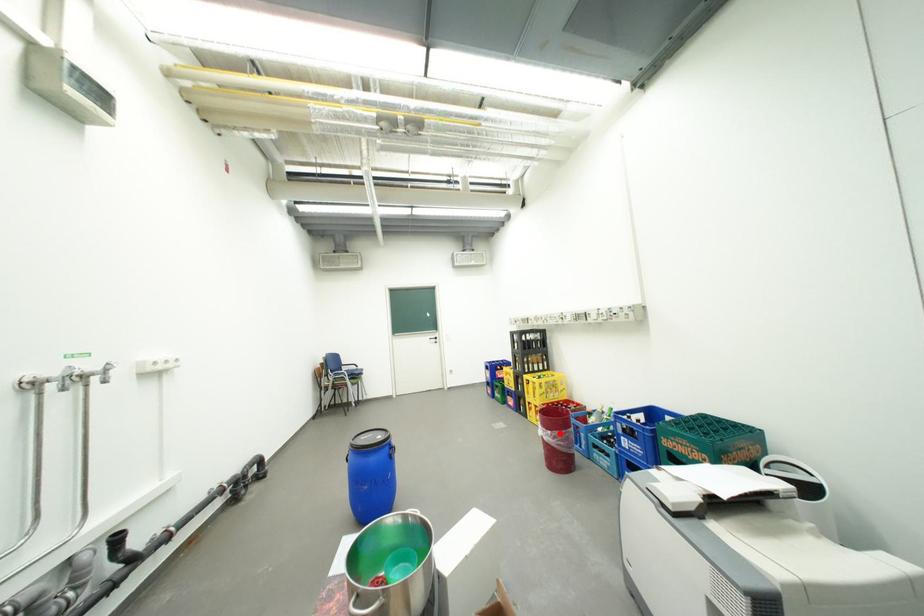
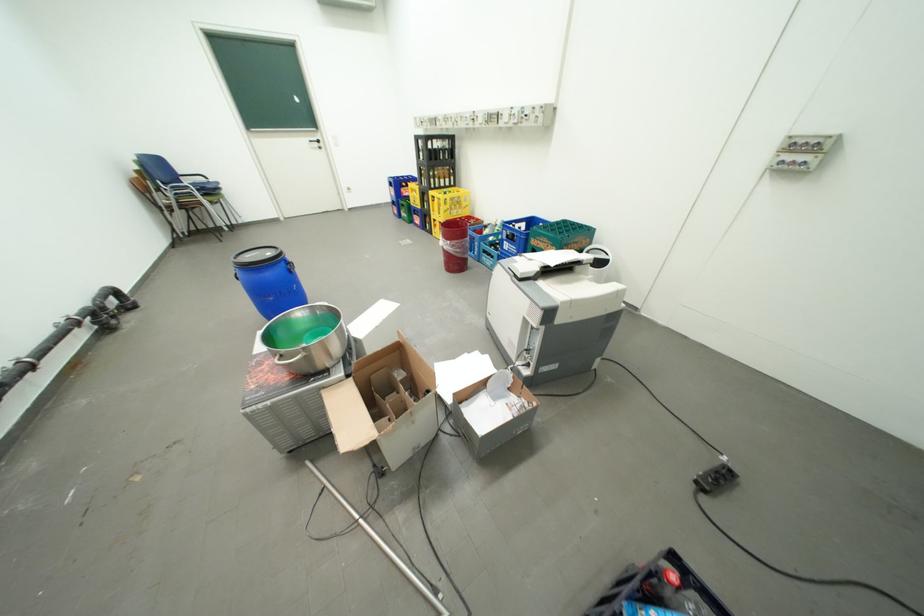
Question: I am providing you with two images of the same scene from different viewpoints. A red point is shown in image1. For the corresponding object point in image2, is it positioned nearer or farther from the camera?

Choices:
 (A) Nearer
 (B) Farther

Answer: (A)